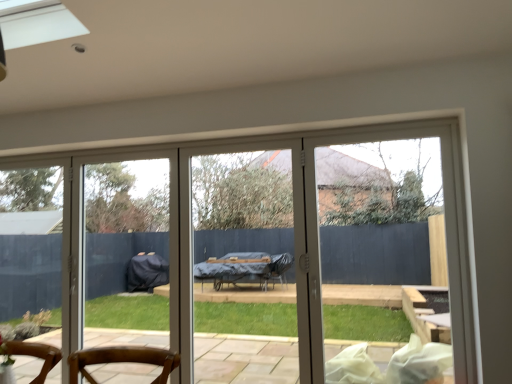
Identify the location of clear glass screen door at center. Image resolution: width=512 pixels, height=384 pixels. (129, 249).

Describe the element at coordinates (129, 249) in the screenshot. I see `clear glass screen door at center` at that location.

Image resolution: width=512 pixels, height=384 pixels. I want to click on white glossy door at center, so click(x=247, y=242).

Image resolution: width=512 pixels, height=384 pixels. What do you see at coordinates (247, 242) in the screenshot?
I see `white glossy door at center` at bounding box center [247, 242].

At what (x,y) coordinates should I click in order to perform the action: click on clear glass screen door at center. Please return your answer as a coordinate pair (x, y). This screenshot has width=512, height=384. Looking at the image, I should click on pos(129,249).

Considering the positions of objects clear glass screen door at center and white glossy door at center in the image provided, who is more to the left, clear glass screen door at center or white glossy door at center?

Positioned to the left is clear glass screen door at center.

Does clear glass screen door at center come behind white glossy door at center?

Yes, the depth of clear glass screen door at center is greater than that of white glossy door at center.

Considering the points (86, 163) and (109, 370), which point is behind, point (86, 163) or point (109, 370)?

Point (86, 163)

From the image's perspective, is clear glass screen door at center beneath white glossy door at center?

Yes.

From a real-world perspective, is clear glass screen door at center physically located above or below white glossy door at center?

Clearly, from a real-world perspective, clear glass screen door at center is above white glossy door at center.

Is clear glass screen door at center wider or thinner than white glossy door at center?

Clearly, clear glass screen door at center has more width compared to white glossy door at center.

Based on the photo, can you confirm if clear glass screen door at center is taller than white glossy door at center?

No, clear glass screen door at center is not taller than white glossy door at center.

Is clear glass screen door at center bigger or smaller than white glossy door at center?

Considering their sizes, clear glass screen door at center takes up less space than white glossy door at center.

Is clear glass screen door at center located outside white glossy door at center?

Yes, clear glass screen door at center is located beyond the bounds of white glossy door at center.

Would you say clear glass screen door at center is a long distance from white glossy door at center?

clear glass screen door at center is positioned a significant distance from white glossy door at center.

Is clear glass screen door at center oriented away from white glossy door at center?

No, clear glass screen door at center's orientation is not away from white glossy door at center.

Can you tell me how much clear glass screen door at center and white glossy door at center differ in facing direction?

The facing directions of clear glass screen door at center and white glossy door at center are 0.142 degrees apart.

How distant is clear glass screen door at center from white glossy door at center?

They are 4.79 meters apart.

Identify the location of screen door above the white glossy door at center (from a real-world perspective). The height and width of the screenshot is (384, 512). (129, 249).

Can you confirm if white glossy door at center is positioned to the left of clear glass screen door at center?

In fact, white glossy door at center is to the right of clear glass screen door at center.

Is white glossy door at center positioned in front of clear glass screen door at center?

Yes, the depth of white glossy door at center is less than that of clear glass screen door at center.

Considering the points (208, 316) and (140, 199), which point is behind, point (208, 316) or point (140, 199)?

The point (140, 199) is farther from the camera.

From the image's perspective, which one is positioned lower, white glossy door at center or clear glass screen door at center?

clear glass screen door at center is shown below in the image.

From a real-world perspective, which is physically above, white glossy door at center or clear glass screen door at center?

clear glass screen door at center, from a real-world perspective.

Which of these two, white glossy door at center or clear glass screen door at center, is thinner?

Thinner between the two is white glossy door at center.

Can you confirm if white glossy door at center is taller than clear glass screen door at center?

Indeed, white glossy door at center has a greater height compared to clear glass screen door at center.

Considering the relative sizes of white glossy door at center and clear glass screen door at center in the image provided, is white glossy door at center bigger than clear glass screen door at center?

Correct, white glossy door at center is larger in size than clear glass screen door at center.

Is white glossy door at center outside of clear glass screen door at center?

Yes.

In the scene shown: Is white glossy door at center not close to clear glass screen door at center?

white glossy door at center is far away from clear glass screen door at center.

Does white glossy door at center turn towards clear glass screen door at center?

No, white glossy door at center does not turn towards clear glass screen door at center.

What's the angular difference between white glossy door at center and clear glass screen door at center's facing directions?

The angle between the facing direction of white glossy door at center and the facing direction of clear glass screen door at center is 0.142 degrees.

What are the coordinates of `door that is in front of the clear glass screen door at center` in the screenshot? It's located at (247, 242).

Locate an element on the screen. The width and height of the screenshot is (512, 384). screen door that is on the left side of white glossy door at center is located at coordinates (129, 249).

Image resolution: width=512 pixels, height=384 pixels. In order to click on door that appears on the right of clear glass screen door at center in this screenshot , I will do `click(247, 242)`.